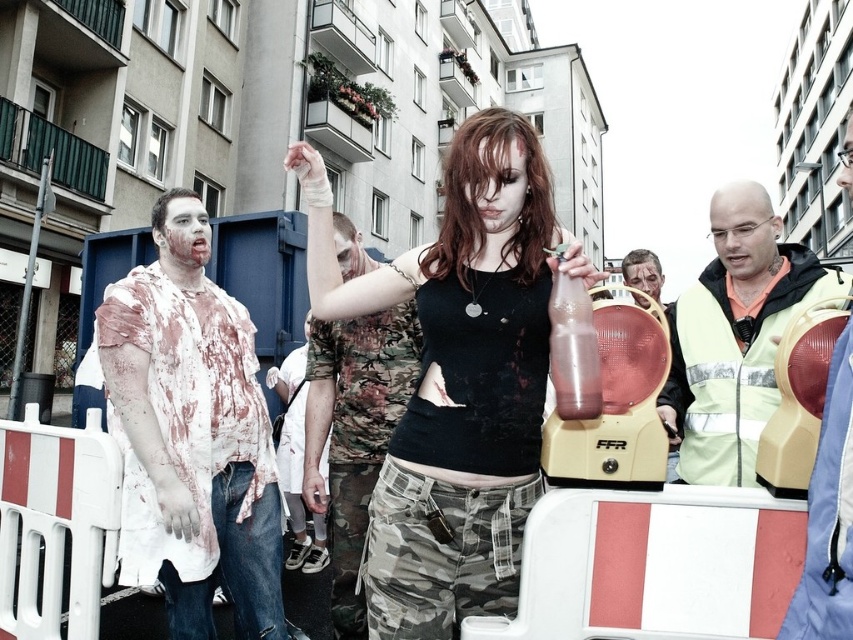
Question: Is the position of translucent plastic bottle at center more distant than that of matte black face paint at center?

Choices:
 (A) yes
 (B) no

Answer: (B)

Question: Which object is the farthest from the blood-stained tattered shirt at center?

Choices:
 (A) translucent plastic bottle at center
 (B) light green reflective vest at center right
 (C) matte black tank top at center

Answer: (B)

Question: Is light green reflective vest at center right wider than translucent plastic bottle at center?

Choices:
 (A) yes
 (B) no

Answer: (A)

Question: Which object is closer to the camera taking this photo?

Choices:
 (A) blood-stained tattered shirt at center
 (B) translucent plastic bottle at center

Answer: (B)

Question: Considering the relative positions of camouflage-patterned shirt at center and translucent plastic bottle at center in the image provided, where is camouflage-patterned shirt at center located with respect to translucent plastic bottle at center?

Choices:
 (A) right
 (B) left

Answer: (B)

Question: Which of these objects is positioned farthest from the matte black face paint at center?

Choices:
 (A) matte black tank top at center
 (B) translucent plastic bottle at center
 (C) blood-stained tattered shirt at center

Answer: (C)